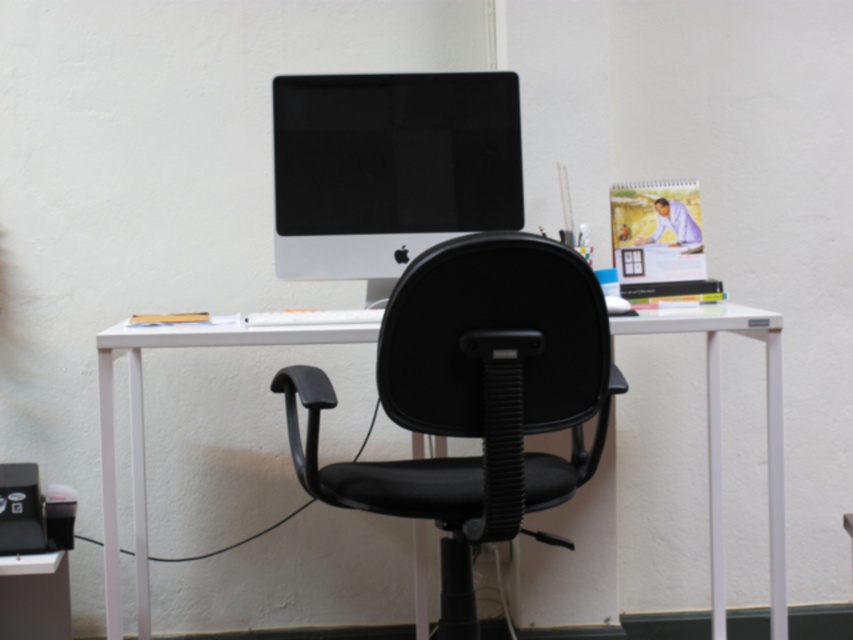
You are sitting in the black leather swivel chair at center and want to reach the sleek silver monitor at center. In which direction should you turn your body to face the monitor?

Since the black leather swivel chair at center is to the right of the sleek silver monitor at center, you should turn your body to the left to face the monitor.

You are sitting in the black leather swivel chair at center and want to reach the white plastic desk at center. How would you describe the position of the chair relative to the desk?

The black leather swivel chair at center is positioned over the white plastic desk at center, meaning it is directly above and resting on top of the desk.